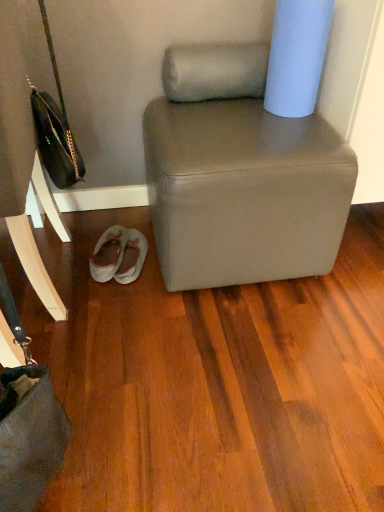
You are a GUI agent. You are given a task and a screenshot of the screen. Output one action in this format:
    pyautogui.click(x=<x>, y=<y>)
    Task: Click on the vacant space underneath leather handbag at left (from a real-world perspective)
    
    Given the screenshot: What is the action you would take?
    pyautogui.click(x=53, y=288)